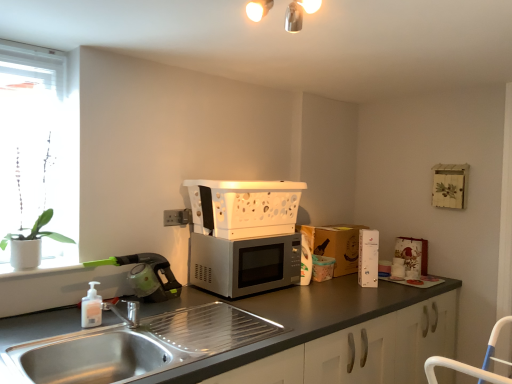
Identify the location of vacant region to the left of white cardboard box at right, which ranks as the 3th appliance in left-to-right order. (343, 281).